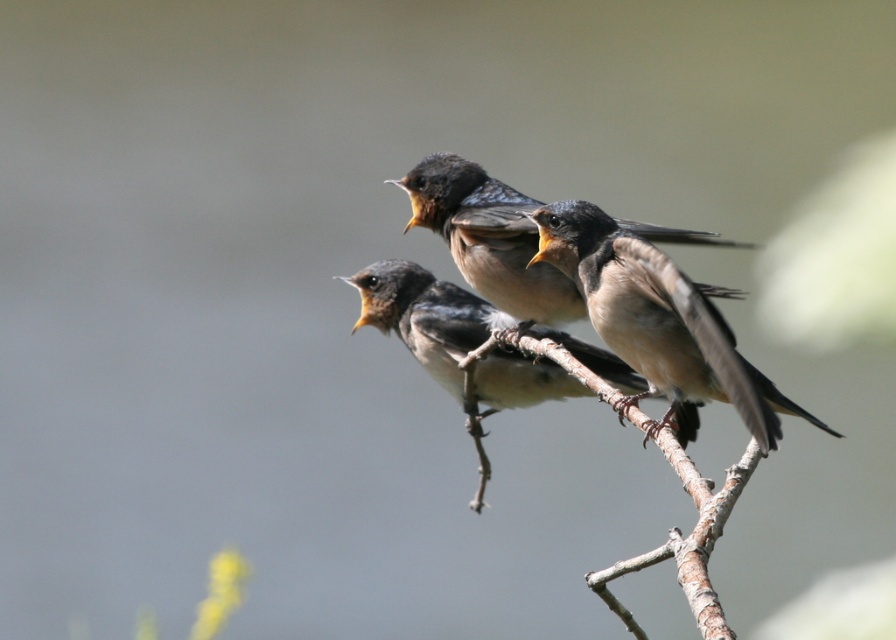
Is brown feathered birds at center taller than brown rough tree branch at center?

No.

Consider the image. Which is more to the right, brown feathered birds at center or brown rough tree branch at center?

brown rough tree branch at center

Which is in front, point (483, 234) or point (681, 452)?

Point (681, 452)

You are a GUI agent. You are given a task and a screenshot of the screen. Output one action in this format:
    pyautogui.click(x=<x>, y=<y>)
    Task: Click on the brown feathered birds at center
    This screenshot has width=896, height=640.
    Given the screenshot: What is the action you would take?
    pyautogui.click(x=489, y=237)

Is brown feathered bird at center thinner than brown rough tree branch at center?

No.

Who is positioned more to the left, brown feathered bird at center or brown rough tree branch at center?

From the viewer's perspective, brown rough tree branch at center appears more on the left side.

Measure the distance between brown feathered bird at center and camera.

brown feathered bird at center is 2.33 meters from camera.

The width and height of the screenshot is (896, 640). I want to click on brown feathered bird at center, so click(658, 323).

Which is more to the right, brown feathered bird at center or brown matte bird at center?

From the viewer's perspective, brown feathered bird at center appears more on the right side.

Does point (708, 380) come behind point (609, 365)?

No, (708, 380) is closer to viewer.

The width and height of the screenshot is (896, 640). I want to click on brown feathered bird at center, so click(658, 323).